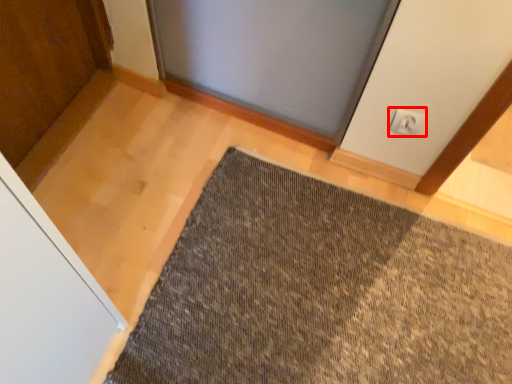
Question: From the image's perspective, considering the relative positions of electric outlet (annotated by the red box) and mat in the image provided, where is electric outlet (annotated by the red box) located with respect to the staircase?

Choices:
 (A) above
 (B) below

Answer: (A)